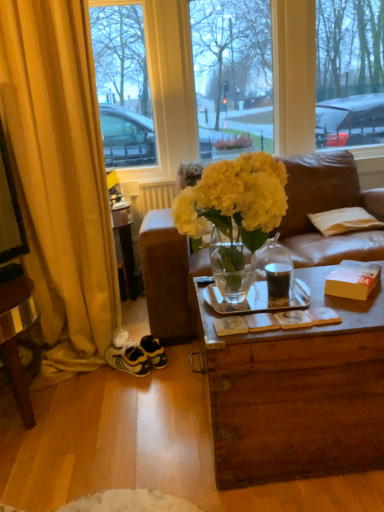
Question: Considering the positions of white striped fabric pillow at right and translucent leather couch at center in the image, is white striped fabric pillow at right wider or thinner than translucent leather couch at center?

Choices:
 (A) wide
 (B) thin

Answer: (B)

Question: Would you say white striped fabric pillow at right is inside or outside translucent leather couch at center?

Choices:
 (A) inside
 (B) outside

Answer: (B)

Question: Which object is the farthest from the yellow fabric curtain at left?

Choices:
 (A) orange cardboard box at right
 (B) yellow suede sneakers at lower left
 (C) white striped fabric pillow at right
 (D) transparent glass window at center
 (E) white matte radiator at upper center

Answer: (C)

Question: Estimate the real-world distances between objects in this image. Which object is closer to the yellow fabric curtain at left?

Choices:
 (A) translucent leather couch at center
 (B) white matte radiator at upper center
 (C) transparent glass window at center
 (D) white striped fabric pillow at right
 (E) orange cardboard box at right

Answer: (B)